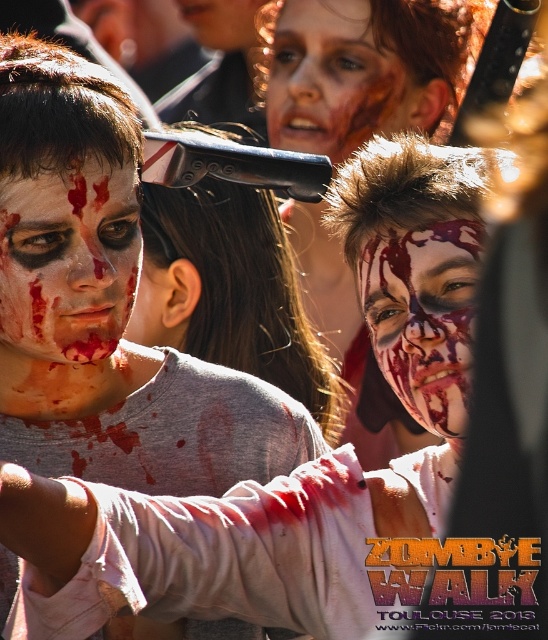
Question: Can you confirm if matte black baseball cap at center is positioned to the left of blood-stained face at upper center?

Choices:
 (A) yes
 (B) no

Answer: (A)

Question: Can you confirm if matte white face at left is bigger than blood-stained face at upper center?

Choices:
 (A) no
 (B) yes

Answer: (A)

Question: Which of the following is the farthest from the observer?

Choices:
 (A) (307, 54)
 (B) (0, 278)

Answer: (A)

Question: Among these points, which one is nearest to the camera?

Choices:
 (A) click(345, 118)
 (B) click(10, 184)
 (C) click(397, 294)
 (D) click(161, 212)

Answer: (B)

Question: Is the position of matte white face at left more distant than that of blood-stained face at upper center?

Choices:
 (A) no
 (B) yes

Answer: (A)

Question: Which point appears closest to the camera in this image?

Choices:
 (A) (1, 248)
 (B) (254, 275)
 (C) (450, 305)
 (D) (275, 100)

Answer: (C)